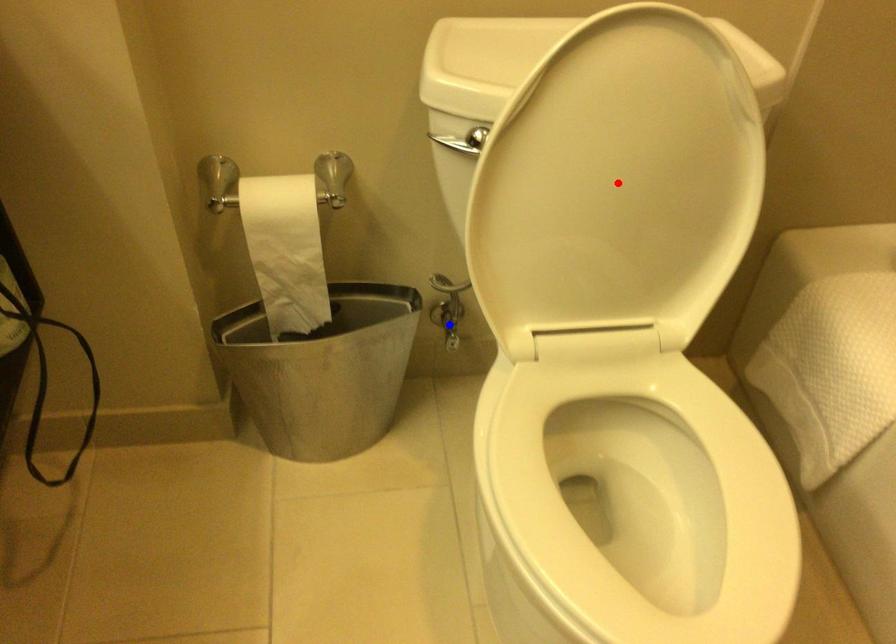
Question: Which of the two points in the image is closer to the camera?

Choices:
 (A) Blue point is closer.
 (B) Red point is closer.

Answer: (B)